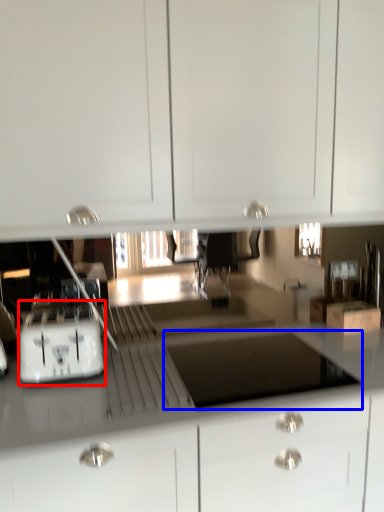
Question: Which point is further to the camera, home appliance (highlighted by a red box) or appliance (highlighted by a blue box)?

Choices:
 (A) home appliance
 (B) appliance

Answer: (A)